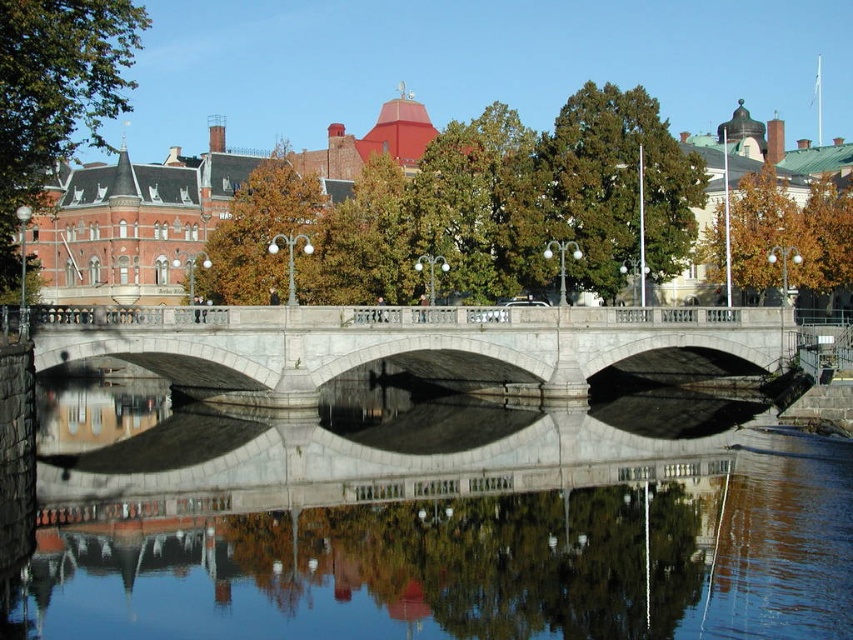
Between green textured tree at upper center and green leafy tree at upper left, which one appears on the left side from the viewer's perspective?

From the viewer's perspective, green leafy tree at upper left appears more on the left side.

How distant is green textured tree at upper center from green leafy tree at upper left?

They are 142.76 feet apart.

Identify the location of green textured tree at upper center. (606, 189).

Can you confirm if transparent water at center is positioned to the right of green textured tree at upper center?

Incorrect, transparent water at center is not on the right side of green textured tree at upper center.

Does point (135, 490) lie behind point (625, 144)?

No, it is in front of (625, 144).

The image size is (853, 640). Find the location of `transparent water at center`. transparent water at center is located at coordinates (433, 522).

Does gray stone bridge at center have a smaller size compared to golden brown leaves at center?

Yes.

Is gray stone bridge at center behind golden brown leaves at center?

No, it is in front of golden brown leaves at center.

The height and width of the screenshot is (640, 853). Find the location of `gray stone bridge at center`. gray stone bridge at center is located at coordinates (422, 344).